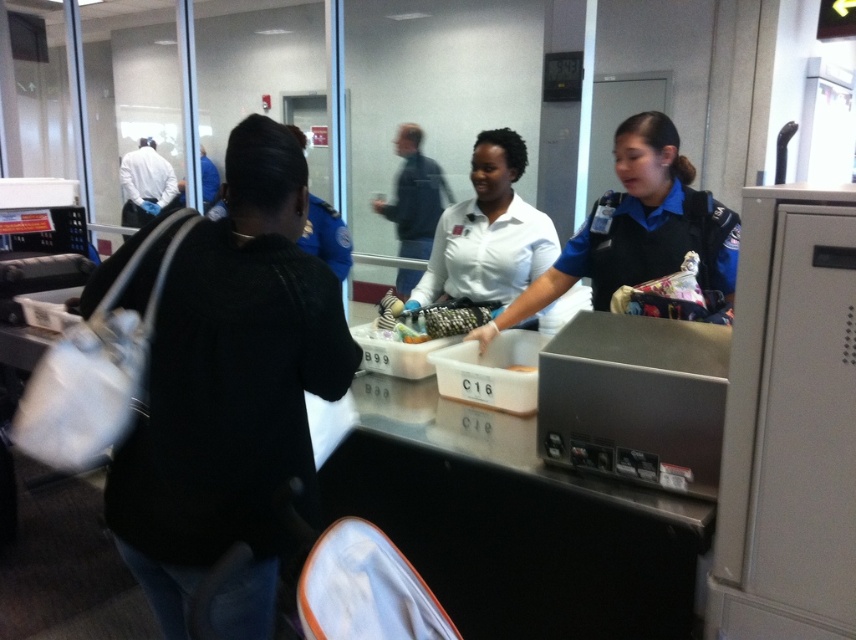
Question: Does black sweater at center appear under white matte uniform at center?

Choices:
 (A) no
 (B) yes

Answer: (B)

Question: Which is farther from the white matte uniform at center?

Choices:
 (A) brown crumbly bread at center
 (B) blue uniform at center

Answer: (A)

Question: Does white matte uniform at center have a smaller size compared to brown crumbly bread at center?

Choices:
 (A) no
 (B) yes

Answer: (A)

Question: Which point is closer to the camera taking this photo?

Choices:
 (A) (645, 186)
 (B) (174, 276)

Answer: (B)

Question: Can you confirm if black sweater at center is positioned to the right of brown crumbly bread at center?

Choices:
 (A) yes
 (B) no

Answer: (B)

Question: Which of these objects is positioned closest to the black sweater at center?

Choices:
 (A) brown crumbly bread at center
 (B) blue uniform at center

Answer: (B)